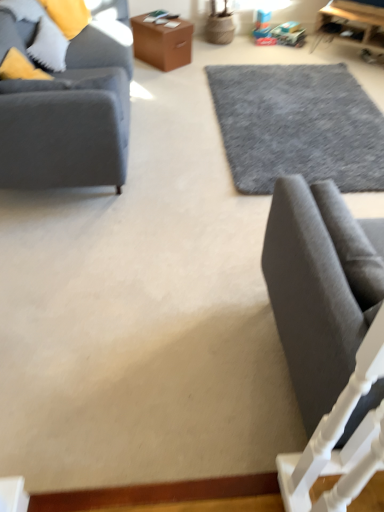
Locate an element on the screen. Image resolution: width=384 pixels, height=512 pixels. brown leather box at upper center, the 1th table in the left-to-right sequence is located at coordinates (162, 42).

Measure the distance between point (329, 105) and camera.

Point (329, 105) is 3.55 meters from camera.

Where is `dark gray fabric studio couch at lower right, which is counted as the second studio couch, starting from the left`? Image resolution: width=384 pixels, height=512 pixels. dark gray fabric studio couch at lower right, which is counted as the second studio couch, starting from the left is located at coordinates (309, 300).

Locate an element on the screen. The image size is (384, 512). matte gray fabric couch at left, the first studio couch viewed from the back is located at coordinates (69, 119).

Identify the location of brown leather box at upper center, which is the second table from right to left. (162, 42).

Can we say dark gray fabric studio couch at lower right, which is counted as the second studio couch, starting from the left, lies outside brown leather box at upper center, which is the second table from right to left?

dark gray fabric studio couch at lower right, which is counted as the second studio couch, starting from the left, is positioned outside brown leather box at upper center, which is the second table from right to left.

In the image, is dark gray fabric studio couch at lower right, placed as the 1th studio couch when sorted from right to left, positioned in front of or behind brown leather box at upper center, the 1th table in the left-to-right sequence?

dark gray fabric studio couch at lower right, placed as the 1th studio couch when sorted from right to left, is in front of brown leather box at upper center, the 1th table in the left-to-right sequence.

Does point (294, 175) lie behind point (166, 61)?

No, (294, 175) is closer to viewer.

From a real-world perspective, does matte gray fabric couch at left, the 1th studio couch in the top-to-bottom sequence, sit lower than dark gray fabric studio couch at lower right, which appears as the first studio couch when ordered from the bottom?

Yes.

Is matte gray fabric couch at left, the first studio couch viewed from the back, turned away from dark gray fabric studio couch at lower right, which is counted as the second studio couch, starting from the left?

No, matte gray fabric couch at left, the first studio couch viewed from the back, is not facing away from dark gray fabric studio couch at lower right, which is counted as the second studio couch, starting from the left.

Find the location of a particular element. studio couch below the dark gray fabric studio couch at lower right, the 1th studio couch positioned from the front (from a real-world perspective) is located at coordinates (69, 119).

Does point (27, 115) lie in front of point (327, 238)?

No, it is not.

Is the depth of gray wool rug at center greater than that of dark gray fabric studio couch at lower right, the 2th studio couch positioned from the back?

That is True.

Locate an element on the screen. The height and width of the screenshot is (512, 384). studio couch below the gray wool rug at center (from the image's perspective) is located at coordinates (309, 300).

Is point (358, 114) closer or farther from the camera than point (346, 313)?

Point (358, 114) is positioned farther from the camera compared to point (346, 313).

From the image's perspective, relative to dark gray fabric studio couch at lower right, placed as the 1th studio couch when sorted from right to left, is gray wool rug at center above or below?

gray wool rug at center is above dark gray fabric studio couch at lower right, placed as the 1th studio couch when sorted from right to left.

How many degrees apart are the facing directions of dark gray fabric studio couch at lower right, which is counted as the second studio couch, starting from the left, and matte gray fabric couch at left, the first studio couch viewed from the back?

The angular difference between dark gray fabric studio couch at lower right, which is counted as the second studio couch, starting from the left, and matte gray fabric couch at left, the first studio couch viewed from the back, is 179 degrees.

Consider the image. Is dark gray fabric studio couch at lower right, the 2th studio couch positioned from the back, not close to matte gray fabric couch at left, the 2th studio couch from the front?

Indeed, dark gray fabric studio couch at lower right, the 2th studio couch positioned from the back, is not near matte gray fabric couch at left, the 2th studio couch from the front.

Does point (284, 191) come in front of point (127, 62)?

Yes, point (284, 191) is closer to viewer.

Based on their sizes in the image, would you say matte gray fabric couch at left, the first studio couch viewed from the back, is bigger or smaller than wooden table at upper right, marked as the second table in a left-to-right arrangement?

Considering their sizes, matte gray fabric couch at left, the first studio couch viewed from the back, takes up more space than wooden table at upper right, marked as the second table in a left-to-right arrangement.

From the image's perspective, between matte gray fabric couch at left, positioned as the 1th studio couch in left-to-right order, and wooden table at upper right, marked as the second table in a left-to-right arrangement, which one is located above?

wooden table at upper right, marked as the second table in a left-to-right arrangement, appears higher in the image.

From a real-world perspective, between matte gray fabric couch at left, the 1th studio couch in the top-to-bottom sequence, and wooden table at upper right, acting as the 1th table starting from the right, who is vertically lower?

In real-world perspective, wooden table at upper right, acting as the 1th table starting from the right, is lower.

How different are the orientations of matte gray fabric couch at left, the 2th studio couch in the bottom-to-top sequence, and wooden table at upper right, acting as the 1th table starting from the right, in degrees?

The facing directions of matte gray fabric couch at left, the 2th studio couch in the bottom-to-top sequence, and wooden table at upper right, acting as the 1th table starting from the right, are 130 degrees apart.

Is gray wool rug at center wider than wooden table at upper right, acting as the 1th table starting from the right?

Indeed, gray wool rug at center has a greater width compared to wooden table at upper right, acting as the 1th table starting from the right.

You are a GUI agent. You are given a task and a screenshot of the screen. Output one action in this format:
    pyautogui.click(x=<x>, y=<y>)
    Task: Click on the plain that is under the wooden table at upper right, marked as the second table in a left-to-right arrangement (from a real-world perspective)
    
    Given the screenshot: What is the action you would take?
    pyautogui.click(x=297, y=126)

Between gray wool rug at center and wooden table at upper right, acting as the 1th table starting from the right, which one appears on the right side from the viewer's perspective?

From the viewer's perspective, wooden table at upper right, acting as the 1th table starting from the right, appears more on the right side.

From a real-world perspective, is gray wool rug at center positioned over wooden table at upper right, marked as the second table in a left-to-right arrangement, based on gravity?

No, from a real-world perspective, gray wool rug at center is not above wooden table at upper right, marked as the second table in a left-to-right arrangement.

Which of these two, brown leather box at upper center, the 1th table in the left-to-right sequence, or dark gray fabric studio couch at lower right, which appears as the first studio couch when ordered from the bottom, is bigger?

Bigger between the two is brown leather box at upper center, the 1th table in the left-to-right sequence.

Who is taller, brown leather box at upper center, the 1th table in the left-to-right sequence, or dark gray fabric studio couch at lower right, placed as the 1th studio couch when sorted from right to left?

Standing taller between the two is dark gray fabric studio couch at lower right, placed as the 1th studio couch when sorted from right to left.

Is brown leather box at upper center, which is the second table from right to left, wider than dark gray fabric studio couch at lower right, the 2th studio couch positioned from the back?

Yes.

Based on the photo, how far apart are brown leather box at upper center, which is the second table from right to left, and dark gray fabric studio couch at lower right, which is counted as the second studio couch, starting from the top?

brown leather box at upper center, which is the second table from right to left, is 9.76 feet from dark gray fabric studio couch at lower right, which is counted as the second studio couch, starting from the top.

At what (x,y) coordinates should I click in order to perform the action: click on table that appears on the left of dark gray fabric studio couch at lower right, placed as the 1th studio couch when sorted from right to left. Please return your answer as a coordinate pair (x, y). Image resolution: width=384 pixels, height=512 pixels. Looking at the image, I should click on [162, 42].

Locate an element on the screen. The image size is (384, 512). studio couch above the dark gray fabric studio couch at lower right, placed as the 1th studio couch when sorted from right to left (from the image's perspective) is located at coordinates (69, 119).

From the image, which object appears to be nearer to matte gray fabric couch at left, which is counted as the second studio couch, starting from the right, gray wool rug at center or brown leather box at upper center, the 1th table in the left-to-right sequence?

The object closer to matte gray fabric couch at left, which is counted as the second studio couch, starting from the right, is gray wool rug at center.

Which object lies nearer to the anchor point dark gray fabric studio couch at lower right, the 1th studio couch positioned from the front, wooden table at upper right, marked as the second table in a left-to-right arrangement, or brown leather box at upper center, which is the second table from right to left?

Based on the image, brown leather box at upper center, which is the second table from right to left, appears to be nearer to dark gray fabric studio couch at lower right, the 1th studio couch positioned from the front.

Which object lies further to the anchor point wooden table at upper right, acting as the 1th table starting from the right, gray wool rug at center or dark gray fabric studio couch at lower right, which is counted as the second studio couch, starting from the left?

Among the two, dark gray fabric studio couch at lower right, which is counted as the second studio couch, starting from the left, is located further to wooden table at upper right, acting as the 1th table starting from the right.

When comparing their distances from matte gray fabric couch at left, the first studio couch viewed from the back, does wooden table at upper right, acting as the 1th table starting from the right, or gray wool rug at center seem further?

Based on the image, wooden table at upper right, acting as the 1th table starting from the right, appears to be further to matte gray fabric couch at left, the first studio couch viewed from the back.

Considering their positions, is dark gray fabric studio couch at lower right, which is counted as the second studio couch, starting from the top, positioned further to matte gray fabric couch at left, the 2th studio couch from the front, than gray wool rug at center?

gray wool rug at center is positioned further to the anchor matte gray fabric couch at left, the 2th studio couch from the front.

Estimate the real-world distances between objects in this image. Which object is closer to brown leather box at upper center, which is the second table from right to left, wooden table at upper right, acting as the 1th table starting from the right, or dark gray fabric studio couch at lower right, the 1th studio couch positioned from the front?

The object closer to brown leather box at upper center, which is the second table from right to left, is wooden table at upper right, acting as the 1th table starting from the right.

Which object lies nearer to the anchor point gray wool rug at center, matte gray fabric couch at left, the 1th studio couch in the top-to-bottom sequence, or brown leather box at upper center, which is the second table from right to left?

brown leather box at upper center, which is the second table from right to left, is positioned closer to the anchor gray wool rug at center.

Considering their positions, is gray wool rug at center positioned further to brown leather box at upper center, the 1th table in the left-to-right sequence, than wooden table at upper right, marked as the second table in a left-to-right arrangement?

wooden table at upper right, marked as the second table in a left-to-right arrangement.

The height and width of the screenshot is (512, 384). In order to click on table situated between matte gray fabric couch at left, positioned as the 1th studio couch in left-to-right order, and gray wool rug at center from left to right in this screenshot , I will do `click(162, 42)`.

Locate an element on the screen. The image size is (384, 512). studio couch between dark gray fabric studio couch at lower right, which is counted as the second studio couch, starting from the top, and wooden table at upper right, marked as the second table in a left-to-right arrangement, from front to back is located at coordinates (69, 119).

Identify the location of table between matte gray fabric couch at left, which is counted as the second studio couch, starting from the right, and wooden table at upper right, marked as the second table in a left-to-right arrangement, from left to right. Image resolution: width=384 pixels, height=512 pixels. (162, 42).

Where is `table between dark gray fabric studio couch at lower right, which appears as the first studio couch when ordered from the bottom, and wooden table at upper right, marked as the second table in a left-to-right arrangement, from front to back`? The image size is (384, 512). table between dark gray fabric studio couch at lower right, which appears as the first studio couch when ordered from the bottom, and wooden table at upper right, marked as the second table in a left-to-right arrangement, from front to back is located at coordinates (162, 42).